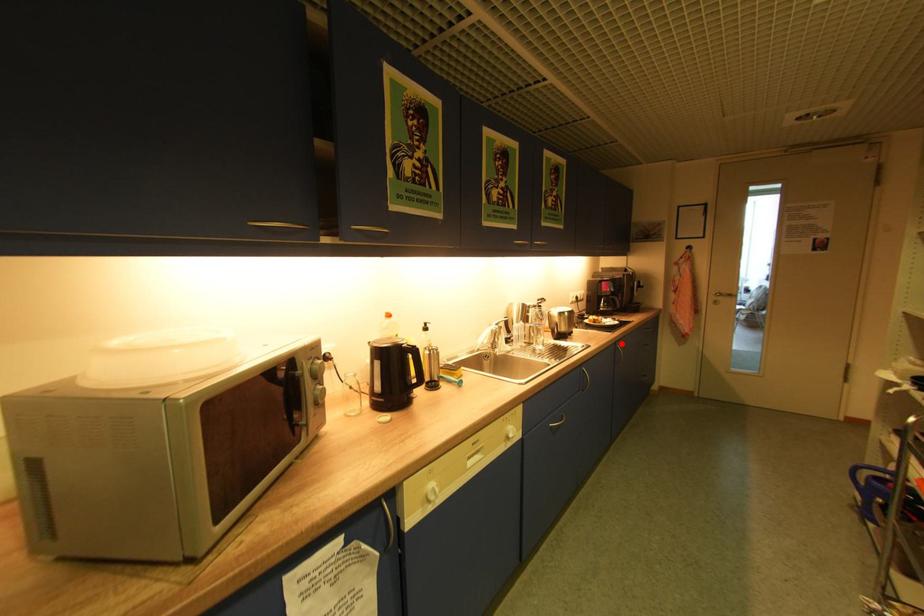
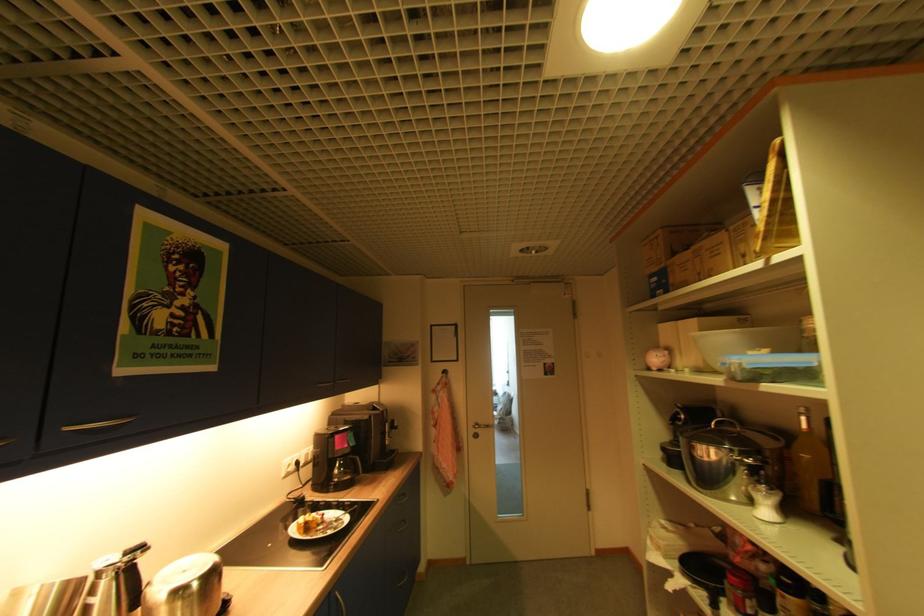
The point at the highlighted location is marked in the first image. Where is the corresponding point in the second image?

(335, 593)